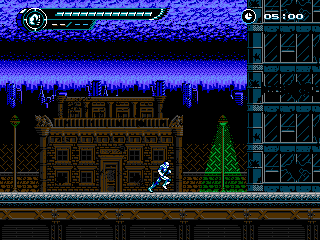
Where is `blue ceiling lights`? blue ceiling lights is located at coordinates (38, 88), (86, 85), (190, 88), (277, 86).